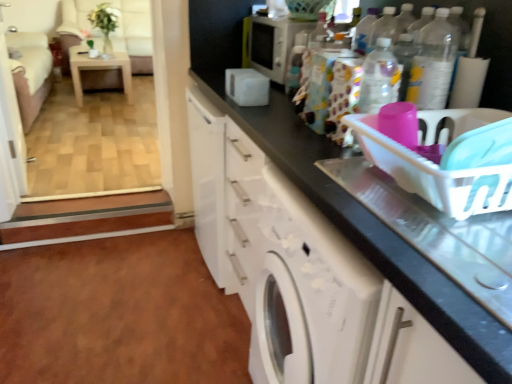
The height and width of the screenshot is (384, 512). In order to click on vacant space situated above brown laminate floor at lower left (from a real-world perspective) in this screenshot , I will do `click(112, 297)`.